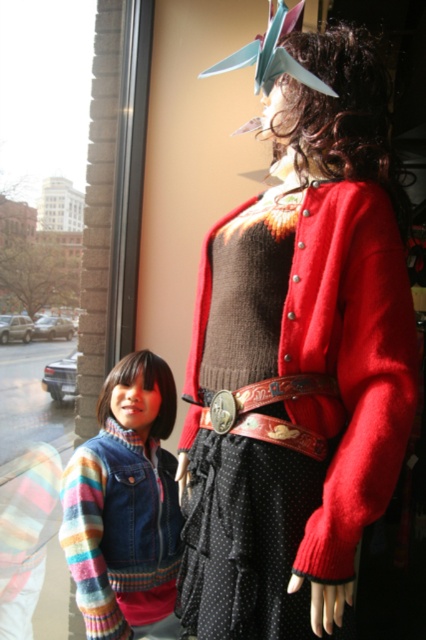
Is red woolen sweater at center bigger than denim jacket at lower left?

Yes, red woolen sweater at center is bigger than denim jacket at lower left.

Can you confirm if red woolen sweater at center is positioned to the right of denim jacket at lower left?

Indeed, red woolen sweater at center is positioned on the right side of denim jacket at lower left.

Is point (287, 568) more distant than point (103, 412)?

That is False.

Where is `red woolen sweater at center`? The image size is (426, 640). red woolen sweater at center is located at coordinates (299, 362).

Consider the image. Is red woolen sweater at center to the left of leather/embossed belt at center from the viewer's perspective?

In fact, red woolen sweater at center is to the right of leather/embossed belt at center.

Does red woolen sweater at center have a smaller size compared to leather/embossed belt at center?

No, red woolen sweater at center is not smaller than leather/embossed belt at center.

Who is more distant from viewer, (x=247, y=506) or (x=294, y=394)?

The point (x=294, y=394) is behind.

The image size is (426, 640). I want to click on red woolen sweater at center, so coord(299,362).

Does denim jacket at lower left appear on the right side of leather/embossed belt at center?

Incorrect, denim jacket at lower left is not on the right side of leather/embossed belt at center.

The image size is (426, 640). Describe the element at coordinates (124, 502) in the screenshot. I see `denim jacket at lower left` at that location.

In order to click on denim jacket at lower left in this screenshot , I will do `click(124, 502)`.

Find the location of a particular element. denim jacket at lower left is located at coordinates (124, 502).